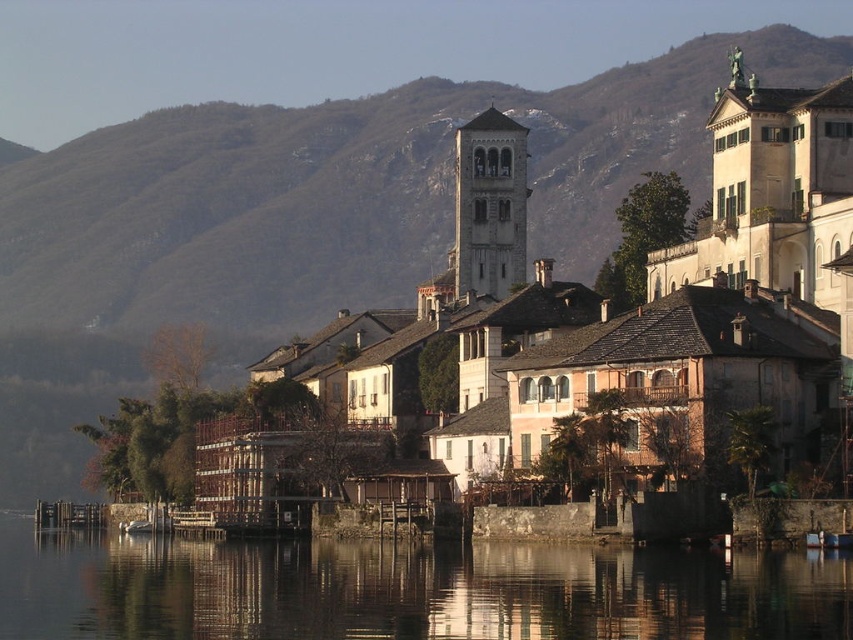
Question: Can you confirm if transparent water at lower center is positioned to the left of gray stone bell tower at center?

Choices:
 (A) no
 (B) yes

Answer: (B)

Question: Which point is farther to the camera?

Choices:
 (A) transparent water at lower center
 (B) gray stone bell tower at center

Answer: (B)

Question: Which of the following is the closest to the observer?

Choices:
 (A) transparent water at lower center
 (B) gray stone bell tower at center

Answer: (A)

Question: Does transparent water at lower center appear on the right side of gray stone bell tower at center?

Choices:
 (A) no
 (B) yes

Answer: (A)

Question: Which point is farther to the camera?

Choices:
 (A) (364, 582)
 (B) (474, 221)

Answer: (B)

Question: Can you confirm if transparent water at lower center is thinner than gray stone bell tower at center?

Choices:
 (A) no
 (B) yes

Answer: (A)